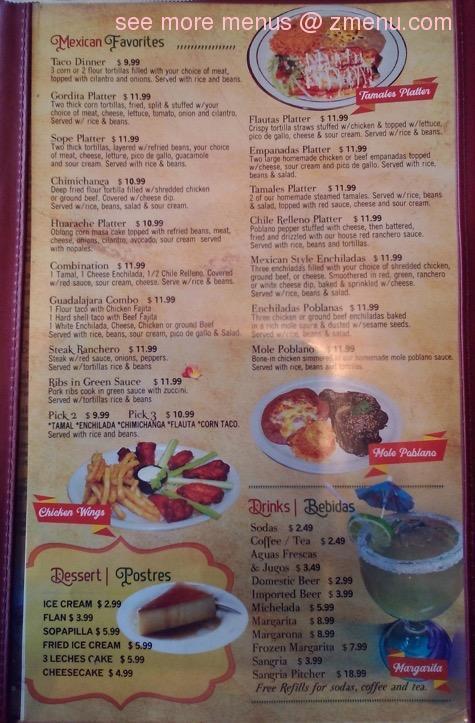
The image size is (475, 723). In order to click on red casing of a menu in this screenshot , I will do `click(13, 273)`.